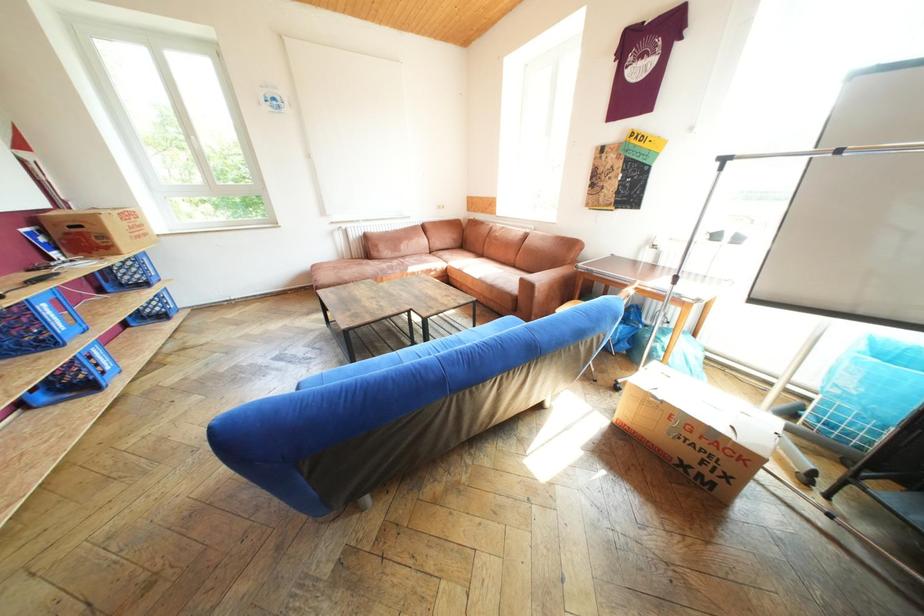
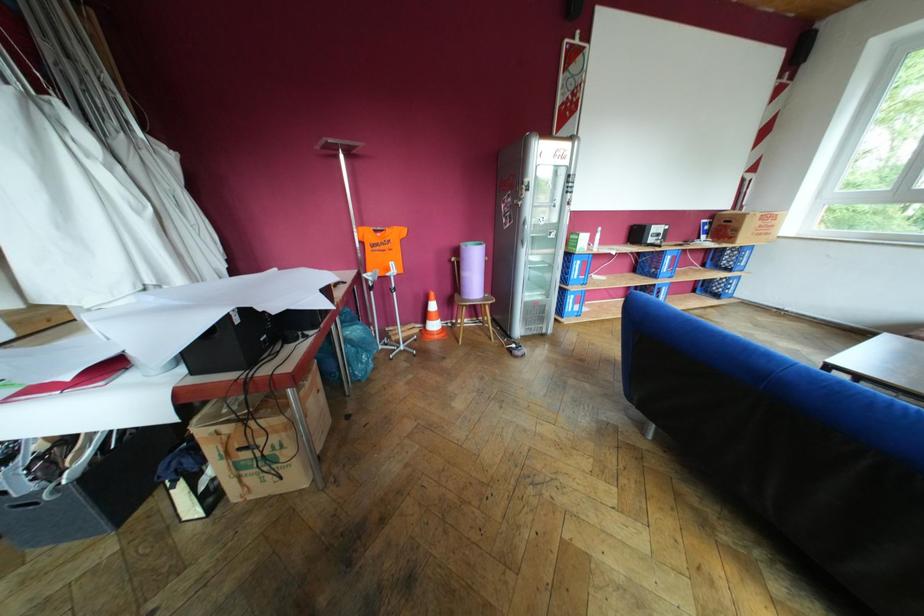
Based on the continuous images, in which direction is the camera rotating?

The camera rotated toward left-down.